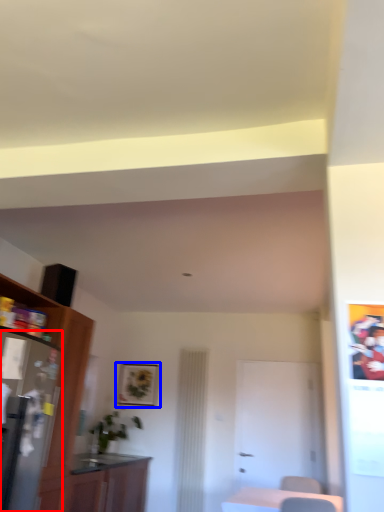
Question: Among these objects, which one is farthest to the camera, appliance (highlighted by a red box) or picture frame (highlighted by a blue box)?

Choices:
 (A) appliance
 (B) picture frame

Answer: (B)